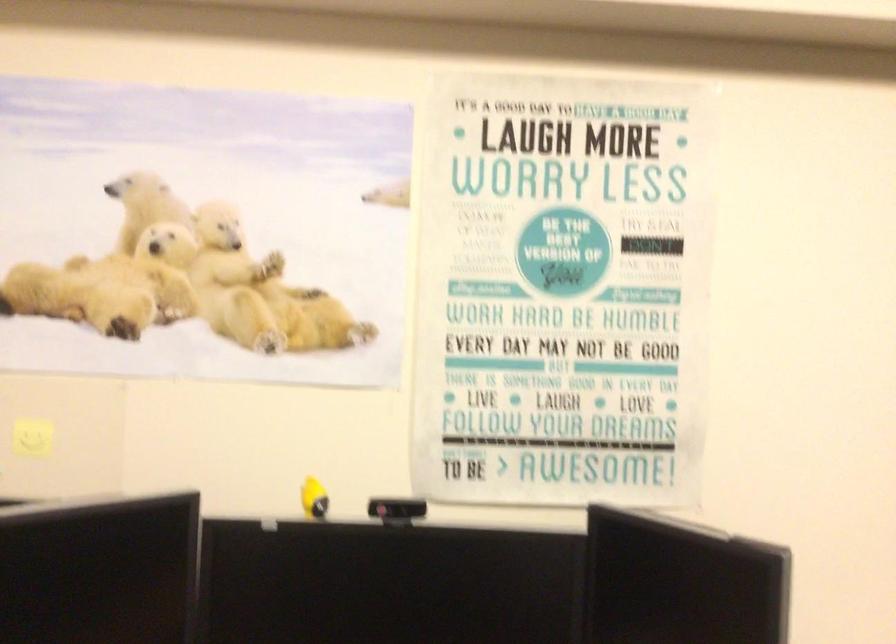
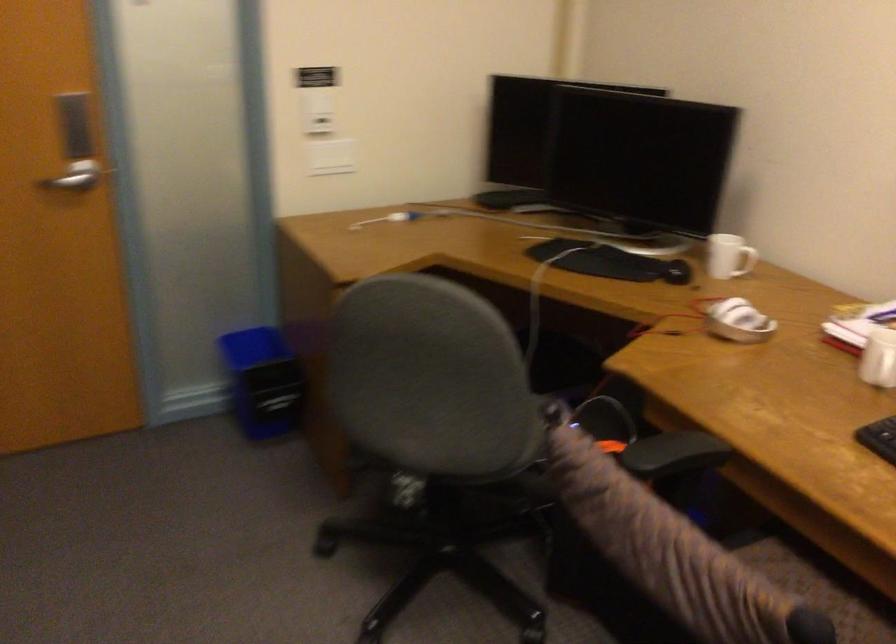
How did the camera likely rotate?

The camera rotated toward left-down.